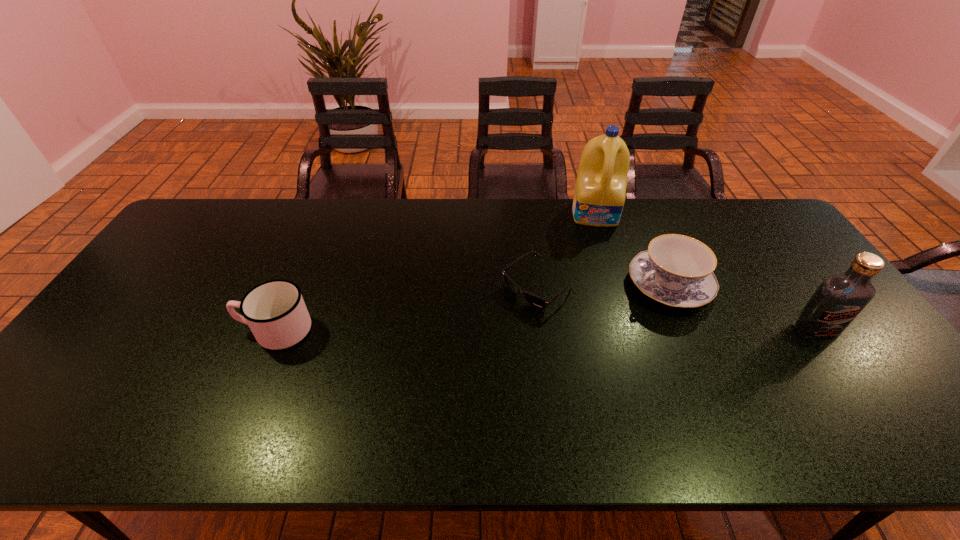
The image size is (960, 540). Identify the location of free point located on the front-facing side of the fourth object from right to left. (487, 328).

This screenshot has height=540, width=960. In order to click on object located at the far edge in this screenshot , I will do `click(599, 197)`.

The height and width of the screenshot is (540, 960). Identify the location of object that is at the right edge. (838, 300).

In order to click on free region at the far edge of the desktop in this screenshot , I will do `click(551, 229)`.

You are a GUI agent. You are given a task and a screenshot of the screen. Output one action in this format:
    pyautogui.click(x=<x>, y=<y>)
    Task: Click on the free space at the near edge
    Image resolution: width=960 pixels, height=540 pixels.
    Given the screenshot: What is the action you would take?
    pyautogui.click(x=418, y=405)

This screenshot has width=960, height=540. I want to click on vacant region at the left edge of the desktop, so click(127, 309).

This screenshot has width=960, height=540. Find the location of `vacant space at the right edge of the desktop`. vacant space at the right edge of the desktop is located at coordinates (848, 363).

This screenshot has width=960, height=540. In the image, there is a desktop. What are the coordinates of `vacant space at the far left corner` in the screenshot? It's located at (184, 221).

Find the location of a particular element. This screenshot has width=960, height=540. free space between the chinaware and the tallest object is located at coordinates (633, 249).

Image resolution: width=960 pixels, height=540 pixels. I want to click on free space that is in between the chinaware and the sunglasses, so click(x=604, y=286).